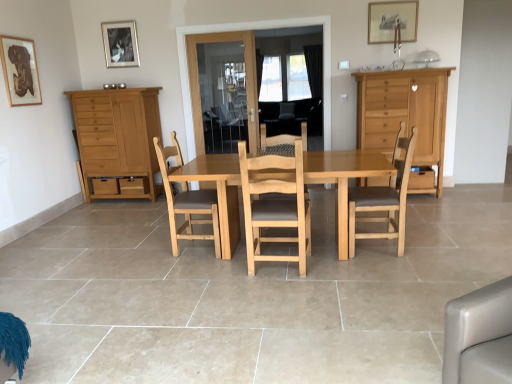
In order to face light brown wood cabinet at right, which is the 1th cabinetry in right-to-left order, should I rotate leftwards or rightwards?

A 18.431 degree turn to the right will do.

What do you see at coordinates (117, 135) in the screenshot? I see `light brown wood cabinet at left, which is counted as the 1th cabinetry, starting from the left` at bounding box center [117, 135].

Describe the element at coordinates (120, 44) in the screenshot. This screenshot has width=512, height=384. I see `metallic silver picture frame at upper center, the first picture frame when ordered from back to front` at that location.

I want to click on light brown wood chair at center, the 1th chair from the right, so click(x=385, y=197).

Image resolution: width=512 pixels, height=384 pixels. Find the location of `light brown wood chair at center, which is the first chair in left-to-right order`. light brown wood chair at center, which is the first chair in left-to-right order is located at coordinates (186, 200).

Locate an element on the screen. This screenshot has width=512, height=384. light brown wood chair at center, acting as the second chair starting from the right is located at coordinates (275, 204).

Between light brown wood cabinet at right, which appears as the 2th cabinetry when viewed from the left, and light brown wood cabinet at left, which is counted as the 1th cabinetry, starting from the left, which one appears on the right side from the viewer's perspective?

Positioned to the right is light brown wood cabinet at right, which appears as the 2th cabinetry when viewed from the left.

Considering the relative sizes of light brown wood cabinet at right, which is the 1th cabinetry in right-to-left order, and light brown wood cabinet at left, marked as the second cabinetry in a right-to-left arrangement, in the image provided, is light brown wood cabinet at right, which is the 1th cabinetry in right-to-left order, smaller than light brown wood cabinet at left, marked as the second cabinetry in a right-to-left arrangement,?

Actually, light brown wood cabinet at right, which is the 1th cabinetry in right-to-left order, might be larger than light brown wood cabinet at left, marked as the second cabinetry in a right-to-left arrangement.

Which object is further away from the camera taking this photo, metallic silver picture frame at upper center, the first picture frame when ordered from back to front, or wooden drawer at right?

metallic silver picture frame at upper center, the first picture frame when ordered from back to front, is behind.

From the image's perspective, is metallic silver picture frame at upper center, the first picture frame when ordered from back to front, located above or below wooden drawer at right?

Clearly, from the image's perspective, metallic silver picture frame at upper center, the first picture frame when ordered from back to front, is above wooden drawer at right.

In terms of width, does metallic silver picture frame at upper center, the first picture frame when ordered from back to front, look wider or thinner when compared to wooden drawer at right?

Considering their sizes, metallic silver picture frame at upper center, the first picture frame when ordered from back to front, looks slimmer than wooden drawer at right.

Does metallic silver picture frame at upper center, the first picture frame when ordered from back to front, turn towards wooden drawer at right?

No, metallic silver picture frame at upper center, the first picture frame when ordered from back to front, does not turn towards wooden drawer at right.

Does light brown wood cabinet at right, which appears as the 2th cabinetry when viewed from the left, lie in front of wooden drawer at right?

Yes, it is.

In order to click on cabinetry that is the 1st object to the left of the wooden drawer at right, starting at the anchor in this screenshot , I will do `click(405, 114)`.

Considering the sizes of light brown wood cabinet at right, which appears as the 2th cabinetry when viewed from the left, and wooden drawer at right in the image, is light brown wood cabinet at right, which appears as the 2th cabinetry when viewed from the left, wider or thinner than wooden drawer at right?

In the image, light brown wood cabinet at right, which appears as the 2th cabinetry when viewed from the left, appears to be wider than wooden drawer at right.

From the image's perspective, is light brown wood cabinet at right, which is the 1th cabinetry in right-to-left order, above or below wooden drawer at right?

light brown wood cabinet at right, which is the 1th cabinetry in right-to-left order, is above wooden drawer at right.

Does point (325, 103) come farther from viewer compared to point (41, 100)?

Yes, point (325, 103) is farther from viewer.

From the picture: From the image's perspective, would you say transparent glass door at center, the 1th glass door in the right-to-left sequence, is positioned over wooden framed map at upper left, positioned as the 3th picture frame in back-to-front order?

Yes, from the image's perspective, transparent glass door at center, the 1th glass door in the right-to-left sequence, is above wooden framed map at upper left, positioned as the 3th picture frame in back-to-front order.

Who is more distant, transparent glass door at center, the 1th glass door in the right-to-left sequence, or wooden framed map at upper left, the 1th picture frame when ordered from left to right?

transparent glass door at center, the 1th glass door in the right-to-left sequence.

Is transparent glass door at center, the second glass door in the left-to-right sequence, oriented away from wooden framed map at upper left, positioned as the 3th picture frame in back-to-front order?

That's not correct — transparent glass door at center, the second glass door in the left-to-right sequence, is not looking away from wooden framed map at upper left, positioned as the 3th picture frame in back-to-front order.

Considering the relative positions of light brown wooden table at center and light brown wood cabinet at left, which is counted as the 1th cabinetry, starting from the left, in the image provided, is light brown wooden table at center to the left of light brown wood cabinet at left, which is counted as the 1th cabinetry, starting from the left, from the viewer's perspective?

No, light brown wooden table at center is not to the left of light brown wood cabinet at left, which is counted as the 1th cabinetry, starting from the left.

From the image's perspective, which object appears higher, light brown wooden table at center or light brown wood cabinet at left, which is counted as the 1th cabinetry, starting from the left?

light brown wood cabinet at left, which is counted as the 1th cabinetry, starting from the left, appears higher in the image.

Which object is thinner, light brown wooden table at center or light brown wood cabinet at left, which is counted as the 1th cabinetry, starting from the left?

light brown wood cabinet at left, which is counted as the 1th cabinetry, starting from the left.

Is light brown wooden table at center further to the viewer compared to light brown wood cabinet at left, which is counted as the 1th cabinetry, starting from the left?

No, the depth of light brown wooden table at center is less than that of light brown wood cabinet at left, which is counted as the 1th cabinetry, starting from the left.

Looking at their sizes, would you say wooden drawer at right is wider or thinner than wooden framed map at upper left, the 1th picture frame when ordered from left to right?

wooden drawer at right is wider than wooden framed map at upper left, the 1th picture frame when ordered from left to right.

Who is taller, wooden drawer at right or wooden framed map at upper left, positioned as the 3th picture frame in back-to-front order?

Standing taller between the two is wooden framed map at upper left, positioned as the 3th picture frame in back-to-front order.

Is wooden drawer at right oriented away from wooden framed map at upper left, acting as the 3th picture frame starting from the right?

No, wooden drawer at right is not facing away from wooden framed map at upper left, acting as the 3th picture frame starting from the right.

Based on their positions, is wooden drawer at right located to the left or right of wooden framed map at upper left, the 1th picture frame when ordered from left to right?

wooden drawer at right is to the right of wooden framed map at upper left, the 1th picture frame when ordered from left to right.

Between light brown wood cabinet at right, which is the 1th cabinetry in right-to-left order, and wooden framed map at upper left, arranged as the first picture frame when viewed from the front, which one has larger size?

light brown wood cabinet at right, which is the 1th cabinetry in right-to-left order.

Which of these two, light brown wood cabinet at right, which appears as the 2th cabinetry when viewed from the left, or wooden framed map at upper left, positioned as the 3th picture frame in back-to-front order, stands taller?

With more height is light brown wood cabinet at right, which appears as the 2th cabinetry when viewed from the left.

From the image's perspective, which one is positioned higher, light brown wood cabinet at right, which is the 1th cabinetry in right-to-left order, or wooden framed map at upper left, positioned as the 3th picture frame in back-to-front order?

wooden framed map at upper left, positioned as the 3th picture frame in back-to-front order, from the image's perspective.

Considering the relative positions of light brown wood cabinet at right, which is the 1th cabinetry in right-to-left order, and wooden framed map at upper left, the 1th picture frame when ordered from left to right, in the image provided, is light brown wood cabinet at right, which is the 1th cabinetry in right-to-left order, to the right of wooden framed map at upper left, the 1th picture frame when ordered from left to right, from the viewer's perspective?

Indeed, light brown wood cabinet at right, which is the 1th cabinetry in right-to-left order, is positioned on the right side of wooden framed map at upper left, the 1th picture frame when ordered from left to right.

Where is `cabinetry below the light brown wood cabinet at right, which appears as the 2th cabinetry when viewed from the left (from the image's perspective)`? Image resolution: width=512 pixels, height=384 pixels. cabinetry below the light brown wood cabinet at right, which appears as the 2th cabinetry when viewed from the left (from the image's perspective) is located at coordinates (117, 135).

The height and width of the screenshot is (384, 512). What are the coordinates of `drawer on the right of metallic silver picture frame at upper center, the 2th picture frame viewed from the left` in the screenshot? It's located at (421, 178).

When comparing their distances from light brown wood chair at center, acting as the second chair starting from the right, does wooden drawer at right or light brown wooden table at center seem closer?

Among the two, light brown wooden table at center is located nearer to light brown wood chair at center, acting as the second chair starting from the right.

Estimate the real-world distances between objects in this image. Which object is closer to light brown wood cabinet at left, marked as the second cabinetry in a right-to-left arrangement, wooden picture frame at upper center, which is the 3th picture frame in left-to-right order, or transparent glass door at center, which is the 1th glass door from left to right?

Based on the image, transparent glass door at center, which is the 1th glass door from left to right, appears to be nearer to light brown wood cabinet at left, marked as the second cabinetry in a right-to-left arrangement.

Based on their spatial positions, is wooden picture frame at upper center, which is the 3th picture frame in left-to-right order, or wooden framed map at upper left, acting as the 3th picture frame starting from the right, further from light brown wooden table at center?

wooden picture frame at upper center, which is the 3th picture frame in left-to-right order, lies further to light brown wooden table at center than the other object.

Looking at the image, which one is located further to light brown wood chair at center, acting as the 3th chair starting from the right, light brown wooden table at center or wooden framed map at upper left, the 1th picture frame when ordered from left to right?

The object further to light brown wood chair at center, acting as the 3th chair starting from the right, is wooden framed map at upper left, the 1th picture frame when ordered from left to right.

Which object lies further to the anchor point light brown wood cabinet at left, which is counted as the 1th cabinetry, starting from the left, light brown wood chair at center, acting as the second chair starting from the right, or wooden framed map at upper left, the 1th picture frame when ordered from left to right?

light brown wood chair at center, acting as the second chair starting from the right.

Looking at the image, which one is located further to wooden framed map at upper left, arranged as the first picture frame when viewed from the front, light brown wood chair at center, which appears as the 3th chair when viewed from the left, or metallic silver picture frame at upper center, the 2th picture frame viewed from the left?

light brown wood chair at center, which appears as the 3th chair when viewed from the left.

Which object lies nearer to the anchor point wooden picture frame at upper center, which appears as the second picture frame when viewed from the front, light brown wood chair at center, acting as the second chair starting from the right, or transparent glass door at center, the second glass door in the left-to-right sequence?

The object closer to wooden picture frame at upper center, which appears as the second picture frame when viewed from the front, is transparent glass door at center, the second glass door in the left-to-right sequence.

Estimate the real-world distances between objects in this image. Which object is further from light brown wood chair at center, which ranks as the 2th chair in left-to-right order, light brown wood cabinet at left, which is counted as the 1th cabinetry, starting from the left, or wooden picture frame at upper center, which appears as the second picture frame when viewed from the front?

wooden picture frame at upper center, which appears as the second picture frame when viewed from the front.

Locate an element on the screen. This screenshot has height=384, width=512. picture frame between light brown wood cabinet at left, marked as the second cabinetry in a right-to-left arrangement, and wooden drawer at right is located at coordinates (392, 21).

Locate an element on the screen. Image resolution: width=512 pixels, height=384 pixels. kitchen & dining room table between light brown wood chair at center, which ranks as the 2th chair in left-to-right order, and light brown wood cabinet at left, which is counted as the 1th cabinetry, starting from the left, from front to back is located at coordinates (205, 197).

Where is `picture frame between wooden framed map at upper left, the 1th picture frame when ordered from left to right, and transparent glass door at center, the 1th glass door in the right-to-left sequence, in the horizontal direction`? This screenshot has width=512, height=384. picture frame between wooden framed map at upper left, the 1th picture frame when ordered from left to right, and transparent glass door at center, the 1th glass door in the right-to-left sequence, in the horizontal direction is located at coordinates pyautogui.click(x=120, y=44).

At what (x,y) coordinates should I click in order to perform the action: click on kitchen & dining room table between light brown wood chair at center, which ranks as the 2th chair in left-to-right order, and transparent glass door at center, the second glass door in the left-to-right sequence, from front to back. Please return your answer as a coordinate pair (x, y). The height and width of the screenshot is (384, 512). Looking at the image, I should click on (205, 197).